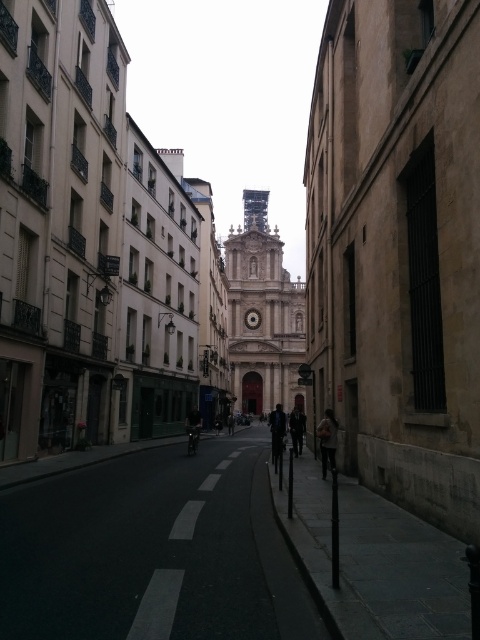
Can you confirm if dark asphalt road at center is positioned below gray fabric bag at center?

Indeed, dark asphalt road at center is positioned under gray fabric bag at center.

Is point (201, 449) positioned in front of point (333, 412)?

No, (201, 449) is behind (333, 412).

Where is `dark asphalt road at center`? Image resolution: width=480 pixels, height=640 pixels. dark asphalt road at center is located at coordinates (153, 550).

Find the location of `dark asphalt road at center`. dark asphalt road at center is located at coordinates (153, 550).

In the scene shown: Does gray fabric bag at center have a lesser height compared to dark gray fabric jacket at center?

Indeed, gray fabric bag at center has a lesser height compared to dark gray fabric jacket at center.

Is gray fabric bag at center thinner than dark gray fabric jacket at center?

Indeed, gray fabric bag at center has a lesser width compared to dark gray fabric jacket at center.

Is point (333, 468) positioned before point (277, 440)?

Yes, it is.

Where is `gray fabric bag at center`? gray fabric bag at center is located at coordinates (327, 440).

Can you confirm if dark asphalt road at center is wider than dark gray fabric jacket at center?

Indeed, dark asphalt road at center has a greater width compared to dark gray fabric jacket at center.

Which is below, dark asphalt road at center or dark gray fabric jacket at center?

dark gray fabric jacket at center is lower down.

Does point (196, 536) come farther from viewer compared to point (277, 440)?

No, it is not.

The width and height of the screenshot is (480, 640). In order to click on dark asphalt road at center in this screenshot , I will do `click(153, 550)`.